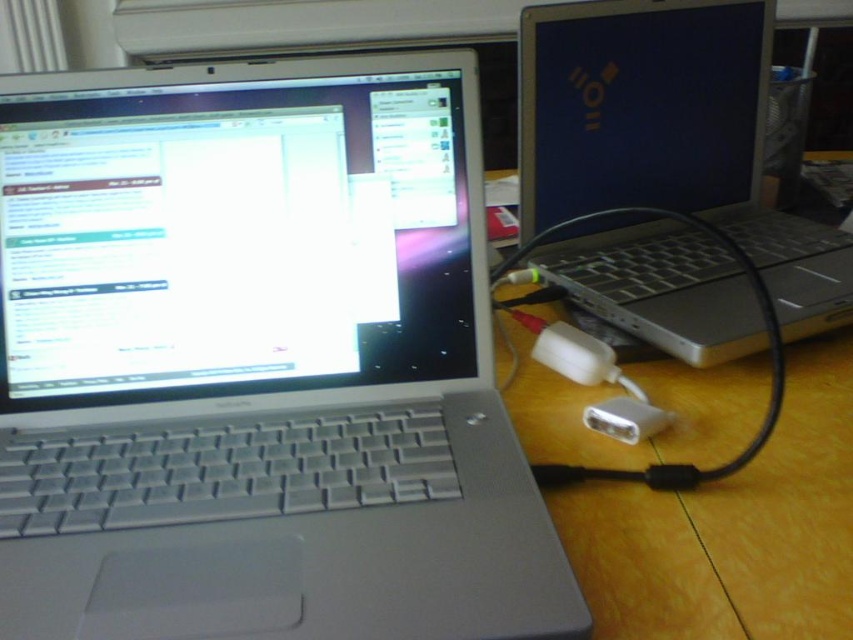
Is silver metallic laptop at left to the right of silver metallic laptop at right from the viewer's perspective?

In fact, silver metallic laptop at left is to the left of silver metallic laptop at right.

Based on the photo, can you confirm if silver metallic laptop at left is thinner than silver metallic laptop at right?

No, silver metallic laptop at left is not thinner than silver metallic laptop at right.

Between point (256, 216) and point (711, 253), which one is positioned in front?

Point (256, 216)

I want to click on silver metallic laptop at left, so click(x=258, y=362).